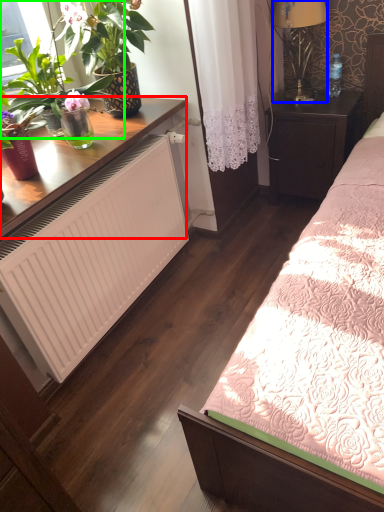
Question: Which object is positioned farthest from desk (highlighted by a red box)? Select from lamp (highlighted by a blue box) and houseplant (highlighted by a green box).

Choices:
 (A) lamp
 (B) houseplant

Answer: (A)